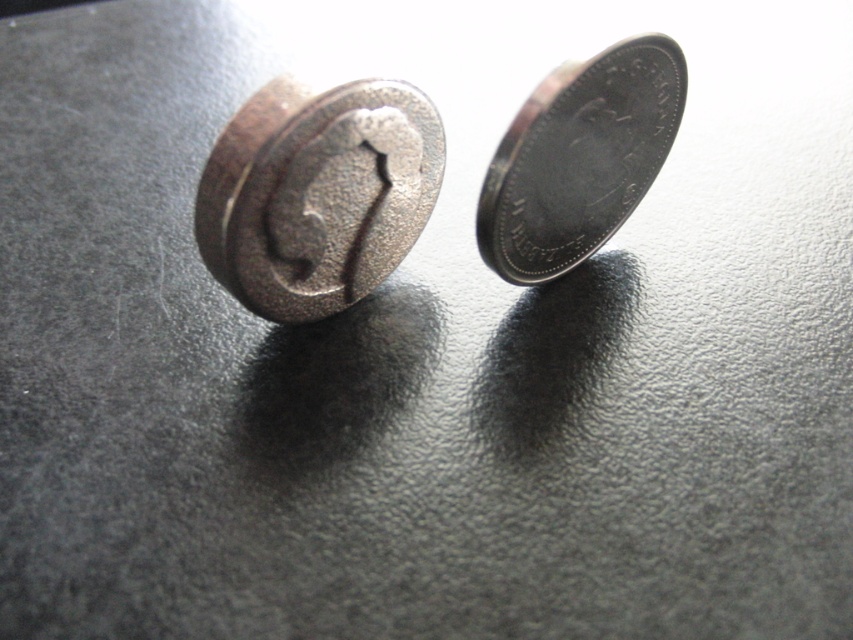
You are an archaeologist examining two coins on a desk. You have the rusty metal coin at center and the silver metallic coin at upper right in front of you. Which coin is located to the left of the other?

The rusty metal coin at center is positioned on the left side of silver metallic coin at upper right.

You are an archaeologist examining two coins in a museum display case. The coins are the rusty metal coin at center and the silver metallic coin at upper right. You need to determine which coin has a larger diameter. Based on the description, which coin is wider?

The rusty metal coin at center has a larger diameter than the silver metallic coin at upper right because its width surpasses the other.

From the picture: You are a coin collector who wants to place both the rusty metal coin at center and the silver metallic coin at upper right into a display case. The display case has two slots, one that can hold coins up to 3 cm in diameter and another for coins up to 4 cm. Which coin should go into which slot?

The rusty metal coin at center is bigger than the silver metallic coin at upper right. Therefore, the rusty metal coin at center should go into the 4 cm slot, and the silver metallic coin at upper right should go into the 3 cm slot.